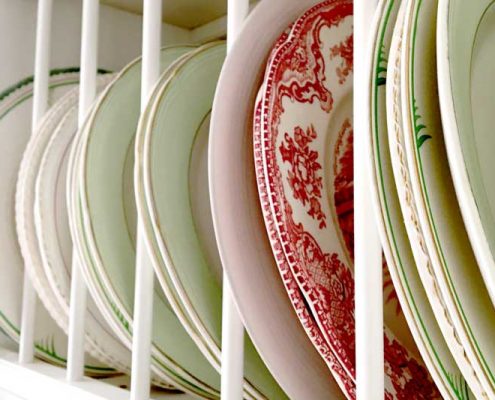
Find the location of a particular element. This screenshot has width=495, height=400. plate border is located at coordinates (464, 124), (430, 147), (293, 180), (237, 199), (172, 194), (110, 196), (57, 209), (0, 181), (35, 244).